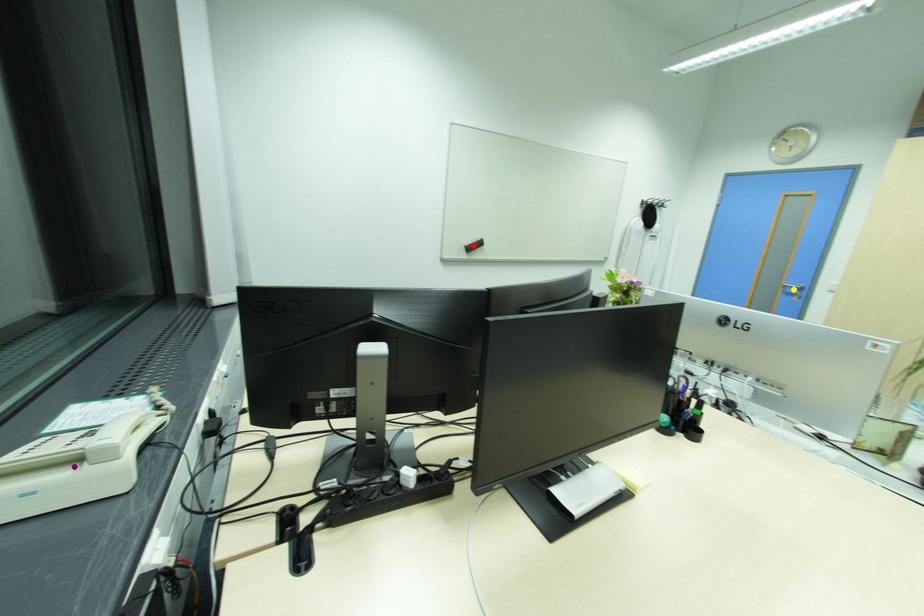
Order these from nearest to farthest:
purple point, yellow point, red point

yellow point → red point → purple point